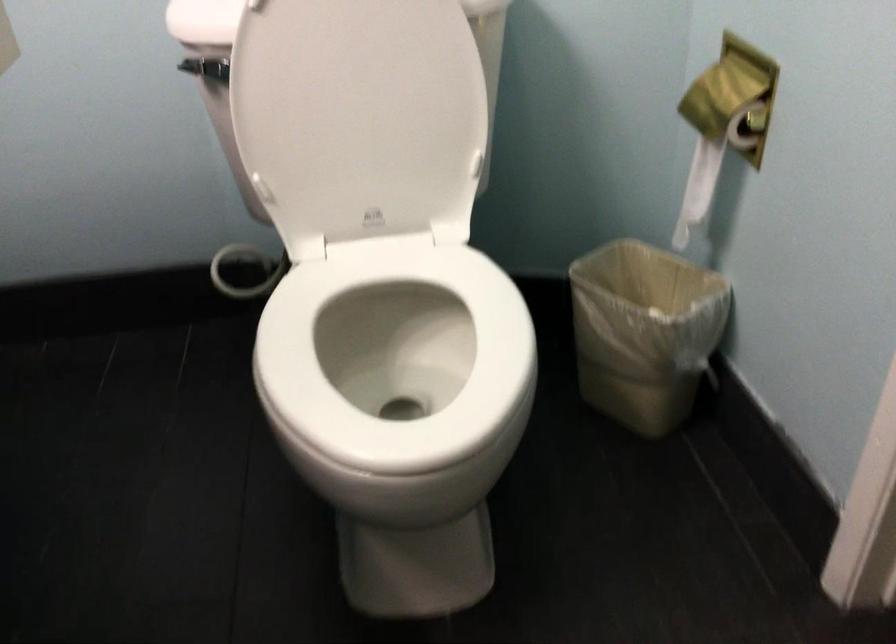
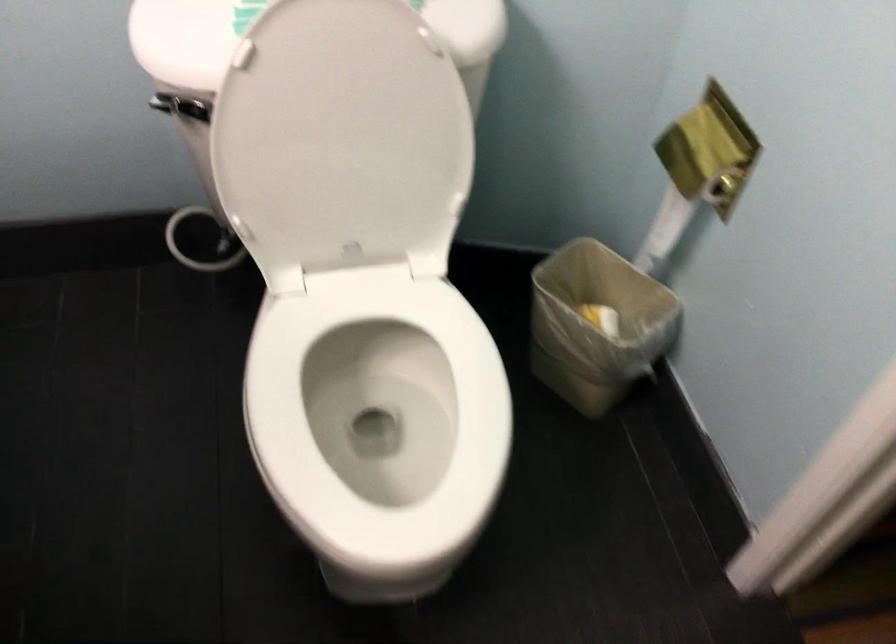
Question: How did the camera likely rotate?

Choices:
 (A) Left
 (B) Right
 (C) Up
 (D) Down

Answer: (D)